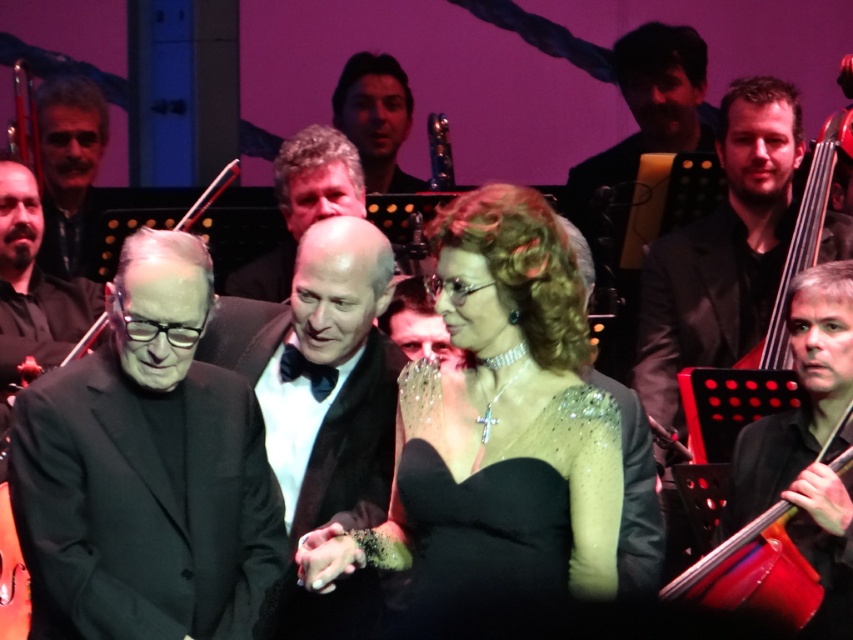
Question: Where is black glossy suit at right located in relation to smooth brown hair at center in the image?

Choices:
 (A) above
 (B) below

Answer: (B)

Question: Can you confirm if black satin tuxedo at center is wider than dark brown leather jacket at left?

Choices:
 (A) no
 (B) yes

Answer: (B)

Question: Which object appears farthest from the camera in this image?

Choices:
 (A) shiny silver hair at center
 (B) black glossy suit at right

Answer: (A)

Question: Does sparkling sequin dress at center appear under dark brown leather jacket at left?

Choices:
 (A) no
 (B) yes

Answer: (B)

Question: Among these points, which one is farthest from the camera?

Choices:
 (A) (161, 634)
 (B) (581, 385)

Answer: (B)

Question: Among these objects, which one is nearest to the camera?

Choices:
 (A) black glossy suit at right
 (B) black matte suit at center
 (C) sparkly black dress at center
 (D) shiny silver hair at center

Answer: (C)